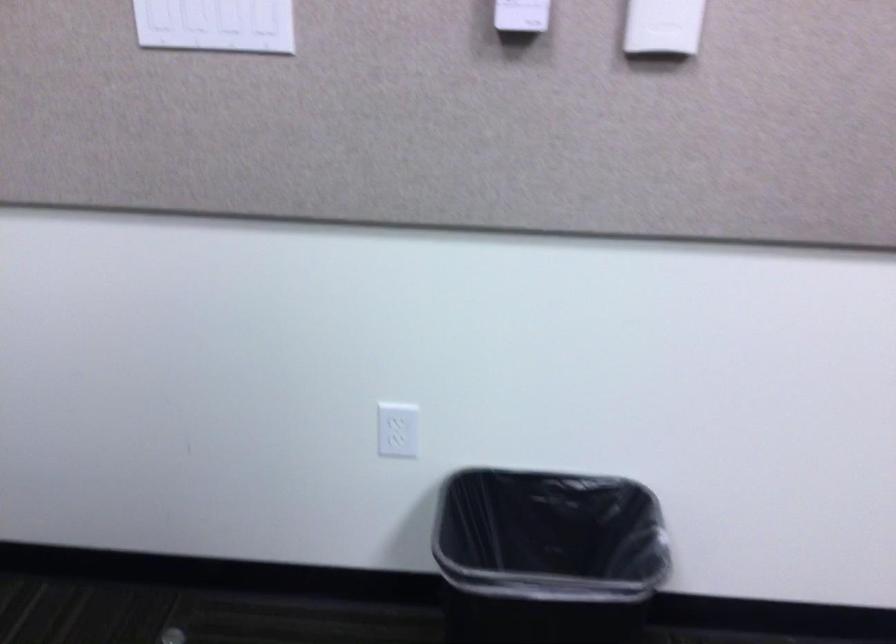
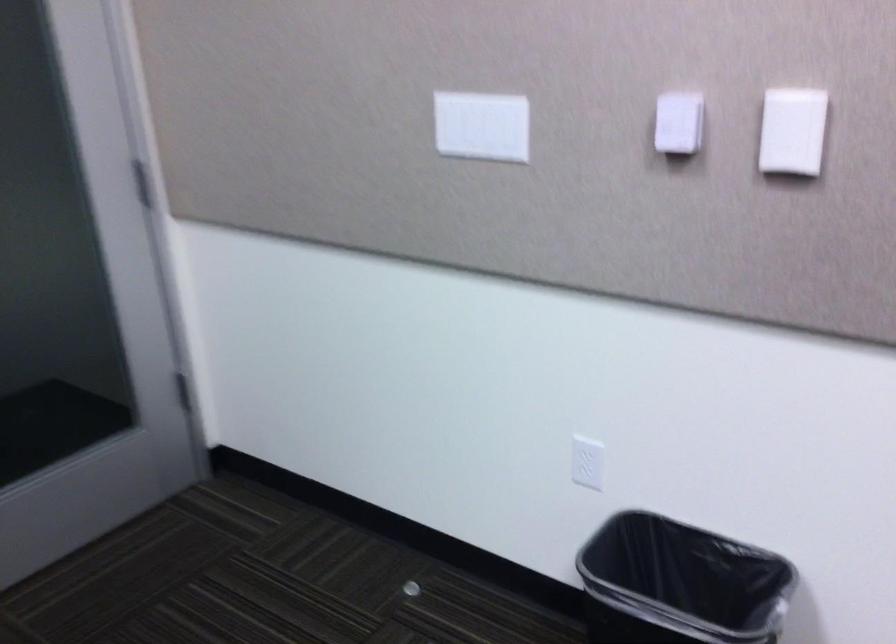
Question: How did the camera likely rotate?

Choices:
 (A) Left
 (B) Right
 (C) Up
 (D) Down

Answer: (A)